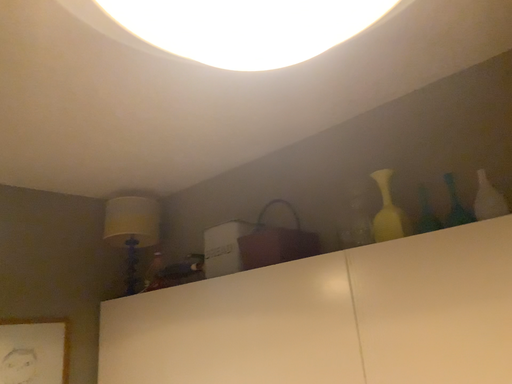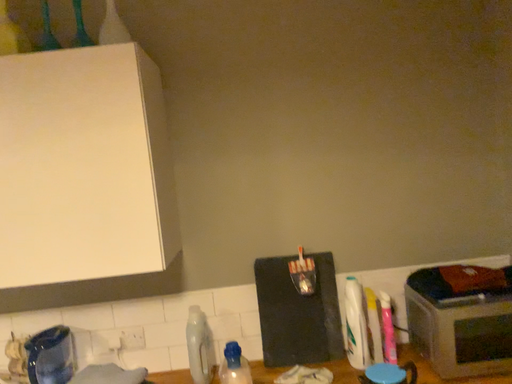
Question: Which way did the camera rotate in the video?

Choices:
 (A) rotated right
 (B) rotated left

Answer: (A)